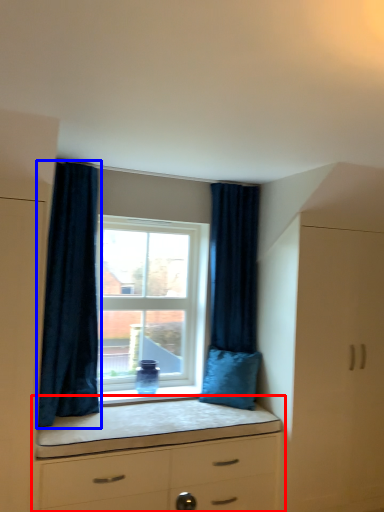
Question: Which object appears farthest to the camera in this image, chest of drawers (highlighted by a red box) or curtain (highlighted by a blue box)?

Choices:
 (A) chest of drawers
 (B) curtain

Answer: (B)